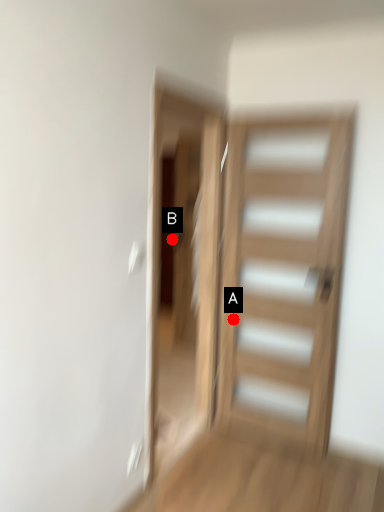
Question: Two points are circled on the image, labeled by A and B beside each circle. Which point is closer to the camera?

Choices:
 (A) A is closer
 (B) B is closer

Answer: (A)